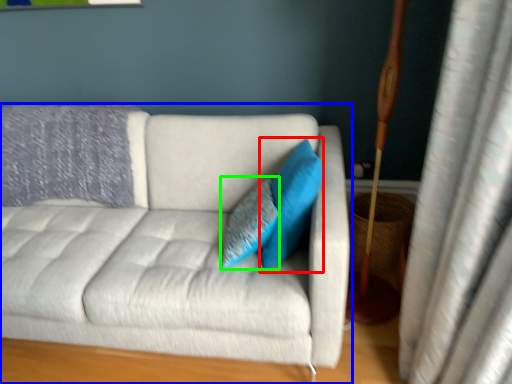
Question: Which is nearer to the pillow (highlighted by a red box)? studio couch (highlighted by a blue box) or pillow (highlighted by a green box).

Choices:
 (A) studio couch
 (B) pillow

Answer: (B)